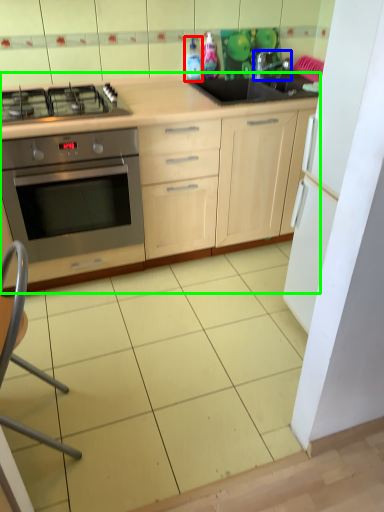
Question: Which object is positioned closest to bottle (highlighted by a red box)? Select from tap (highlighted by a blue box) and cabinetry (highlighted by a green box).

Choices:
 (A) tap
 (B) cabinetry

Answer: (A)